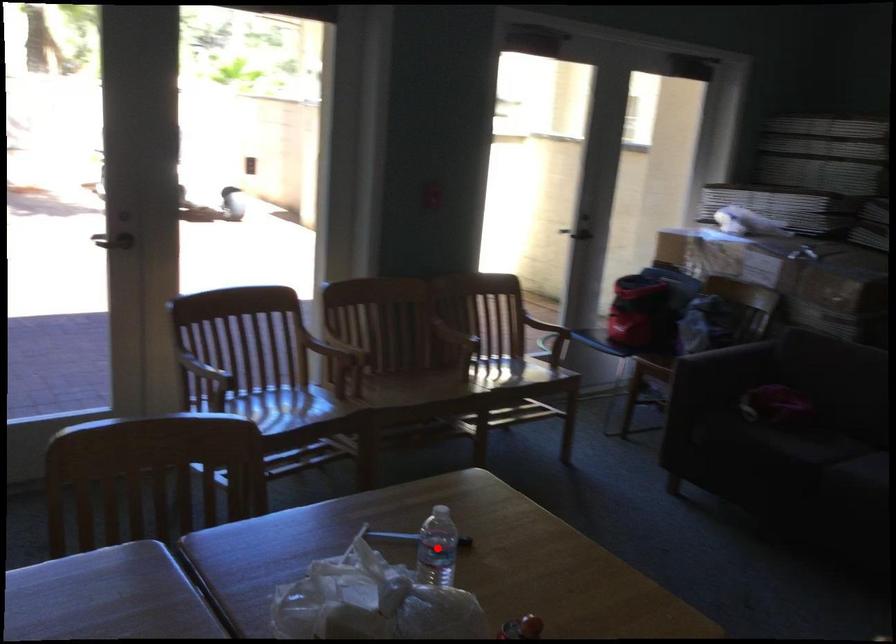
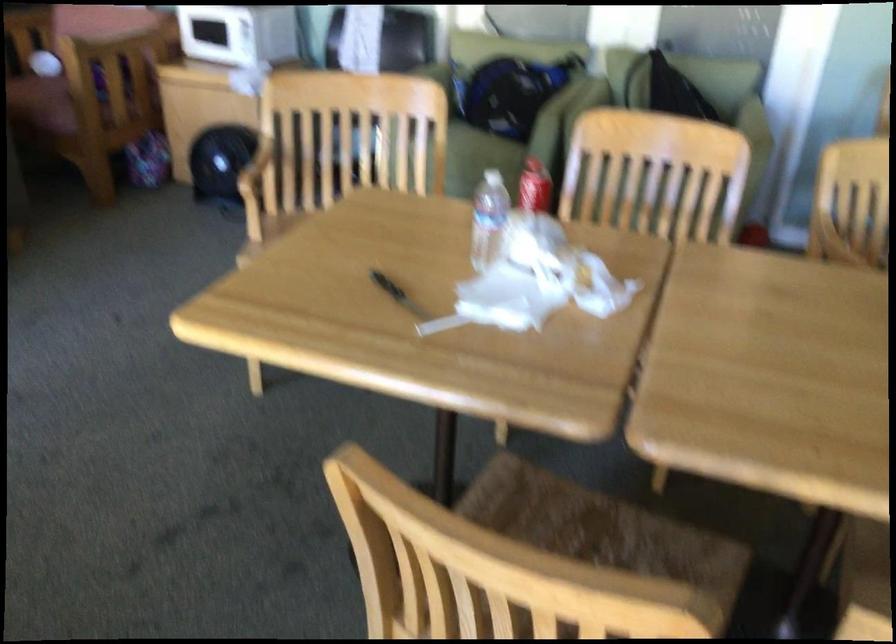
Question: I am providing you with two images of the same scene from different viewpoints. A red point is marked on the first image. Can you still see the location of the red point in image 2?

Choices:
 (A) Yes
 (B) No

Answer: (B)